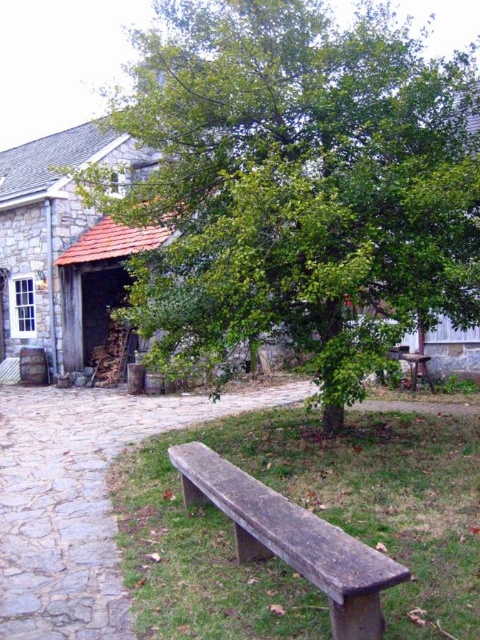
You are standing at the entrance of the rustic stone building with a red roof. You see the weathered wood bench at lower center. Can you tell me the exact coordinates of the bench?

The weathered wood bench at lower center is located at coordinates point (292, 540).

You are standing in front of the rustic stone building with a red roof and want to place two markers at the specified coordinates. Which of the two points, point (368, 628) or point (402, 358), will be closer to you when placed on the scene?

Point (368, 628) is closer to the viewer than point (402, 358).

From the picture: You are standing in front of the rustic stone building with a red roof. You see a weathered wood bench at lower center and a wooden bench at center. Which bench is closer to the building?

The weathered wood bench at lower center is closer to the building because it is located below the wooden bench at center, meaning it is positioned nearer to the structure.